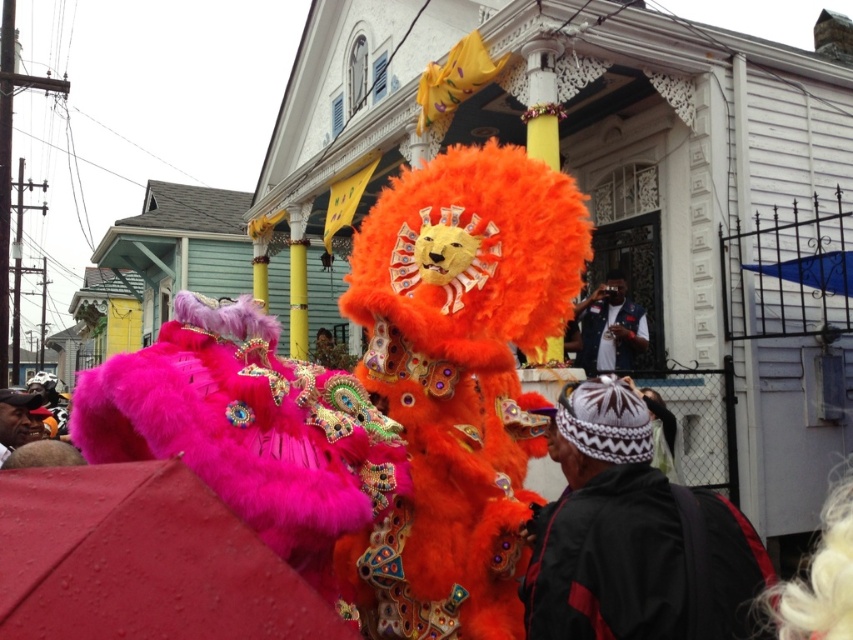
Question: Which point is farther to the camera?

Choices:
 (A) matte black cap at lower left
 (B) fuzzy pink costume at center
 (C) denim vest at center
 (D) velvet black jacket at center

Answer: (C)

Question: Estimate the real-world distances between objects in this image. Which object is closer to the velvet black jacket at center?

Choices:
 (A) denim vest at center
 (B) matte black cap at lower left
 (C) fuzzy pink costume at center

Answer: (C)

Question: Is velvet black jacket at center wider than matte black cap at lower left?

Choices:
 (A) yes
 (B) no

Answer: (B)

Question: Can you confirm if fuzzy pink costume at center is thinner than matte black cap at lower left?

Choices:
 (A) yes
 (B) no

Answer: (B)

Question: Can you confirm if velvet black jacket at center is positioned below matte black cap at lower left?

Choices:
 (A) yes
 (B) no

Answer: (B)

Question: Which object is the farthest from the fuzzy pink costume at center?

Choices:
 (A) matte black cap at lower left
 (B) denim vest at center
 (C) velvet black jacket at center

Answer: (B)